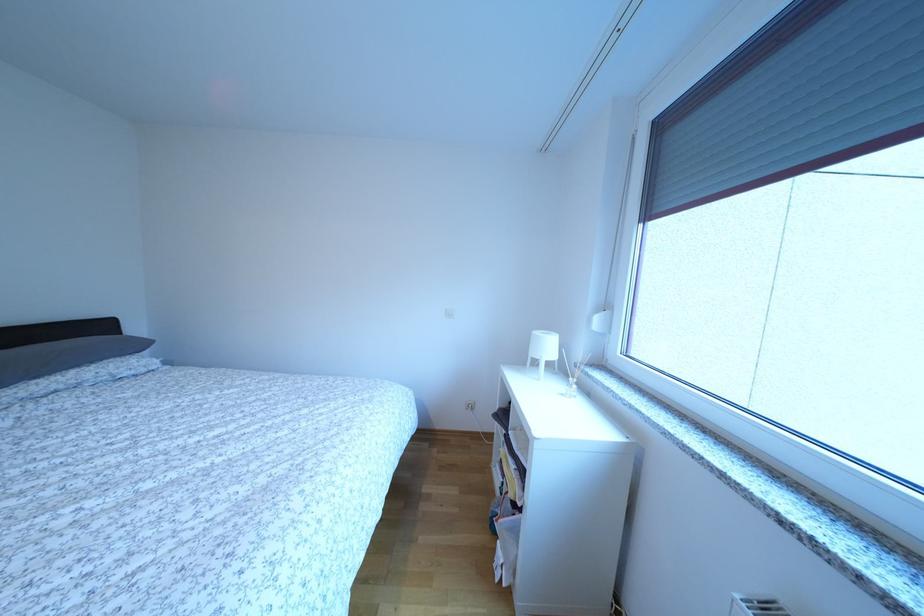
Which object does [569,389] point to?

It corresponds to the reed diffuser in the image.